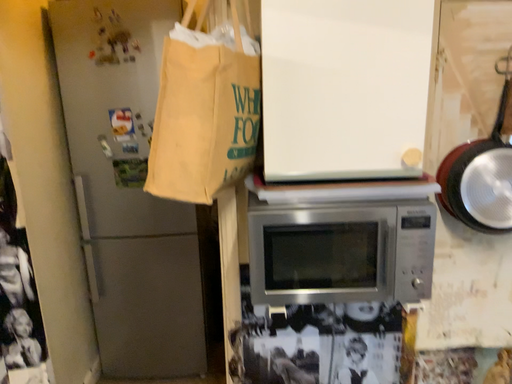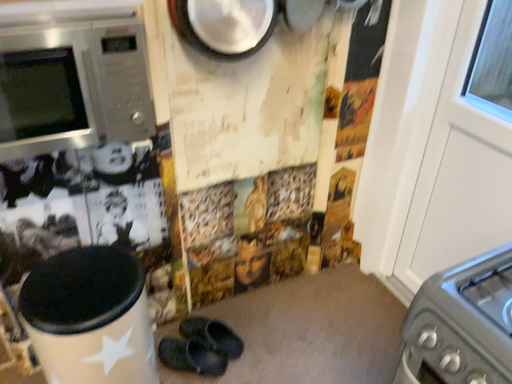
Question: How did the camera likely rotate when shooting the video?

Choices:
 (A) rotated left
 (B) rotated right

Answer: (B)